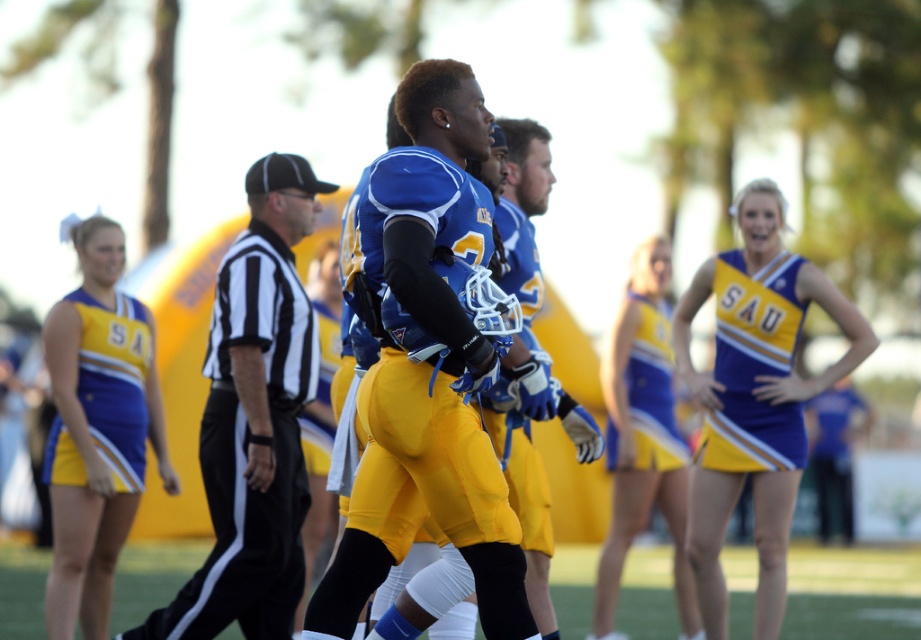
Does black and white striped shirt at center have a greater height compared to matte yellow cheerleading outfit at left?

Indeed, black and white striped shirt at center has a greater height compared to matte yellow cheerleading outfit at left.

Is black and white striped shirt at center further to camera compared to matte yellow cheerleading outfit at left?

No.

Does point (296, 230) come farther from viewer compared to point (127, 410)?

No, it is in front of (127, 410).

Where is `black and white striped shirt at center`? The width and height of the screenshot is (921, 640). black and white striped shirt at center is located at coordinates (254, 420).

Is matte blue jersey at center further to camera compared to black and white striped shirt at center?

No, it is in front of black and white striped shirt at center.

Can you confirm if matte blue jersey at center is shorter than black and white striped shirt at center?

Yes, matte blue jersey at center is shorter than black and white striped shirt at center.

Image resolution: width=921 pixels, height=640 pixels. I want to click on matte blue jersey at center, so click(426, 364).

Between black and white striped shirt at center and yellow satin skirt at right, which one has less height?

yellow satin skirt at right is shorter.

Locate an element on the screen. black and white striped shirt at center is located at coordinates (254, 420).

Describe the element at coordinates (254, 420) in the screenshot. I see `black and white striped shirt at center` at that location.

Locate an element on the screen. black and white striped shirt at center is located at coordinates (254, 420).